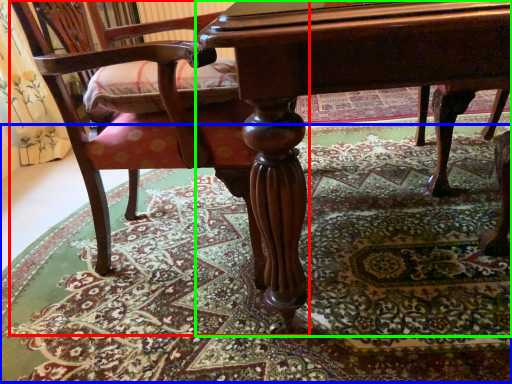
Question: Based on their relative distances, which object is nearer to chair (highlighted by a red box)? Choose from mat (highlighted by a blue box) and table (highlighted by a green box).

Choices:
 (A) mat
 (B) table

Answer: (B)